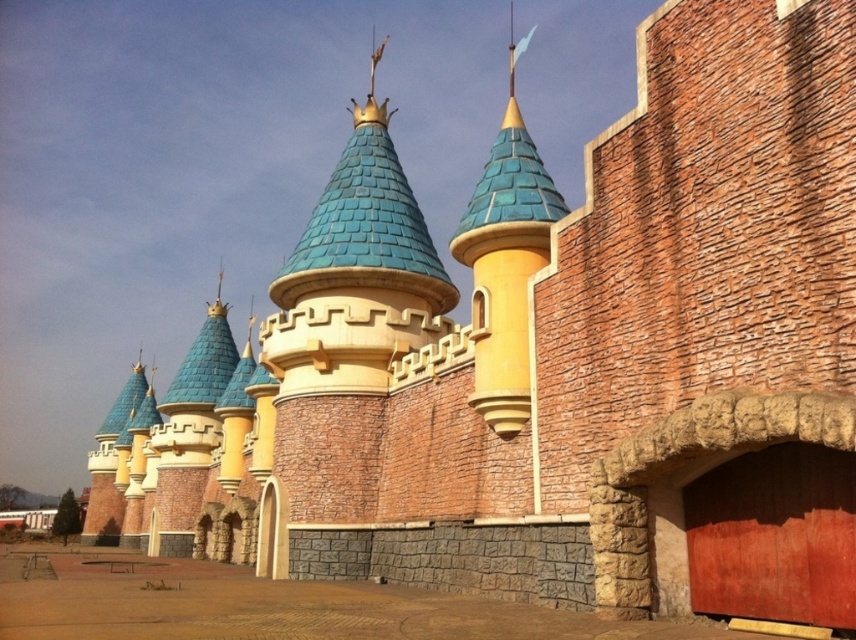
Does red matte garage door at lower right have a smaller size compared to matte blue tile tower at center?

Yes.

This screenshot has height=640, width=856. Identify the location of red matte garage door at lower right. (774, 536).

Image resolution: width=856 pixels, height=640 pixels. I want to click on red matte garage door at lower right, so click(x=774, y=536).